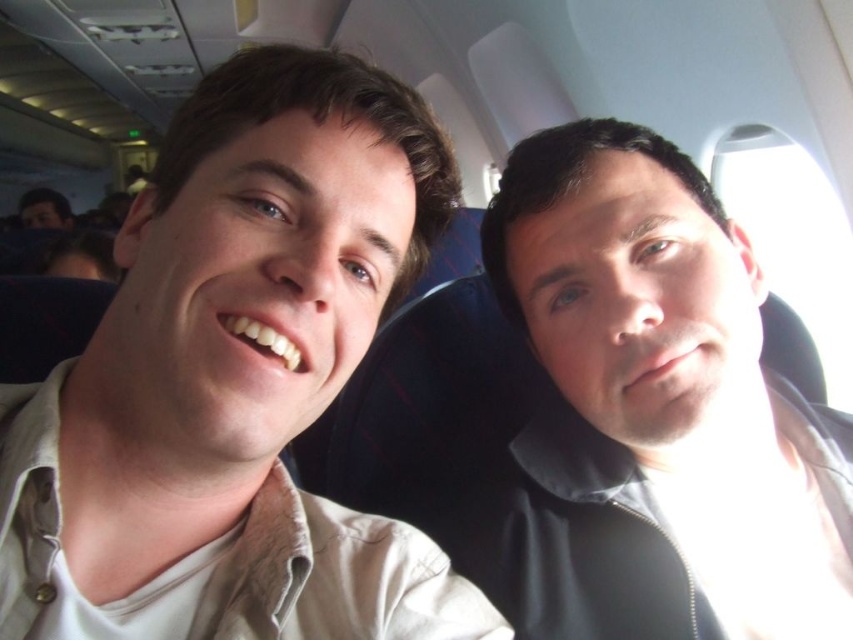
Based on the photo, which is more to the right, matte black jacket at right or matte black face at left?

Positioned to the right is matte black jacket at right.

At what (x,y) coordinates should I click in order to perform the action: click on matte black jacket at right. Please return your answer as a coordinate pair (x, y). The width and height of the screenshot is (853, 640). Looking at the image, I should click on (670, 385).

Looking at this image, can you confirm if light beige shirt at left is wider than matte black face at left?

No.

Which of these two, light beige shirt at left or matte black face at left, stands shorter?

With less height is matte black face at left.

Is point (328, 179) positioned before point (22, 225)?

Yes, point (328, 179) is in front of point (22, 225).

Locate an element on the screen. light beige shirt at left is located at coordinates (235, 380).

Does point (204, 138) come farther from viewer compared to point (583, 337)?

No, it is not.

Locate an element on the screen. This screenshot has width=853, height=640. light beige shirt at left is located at coordinates (235, 380).